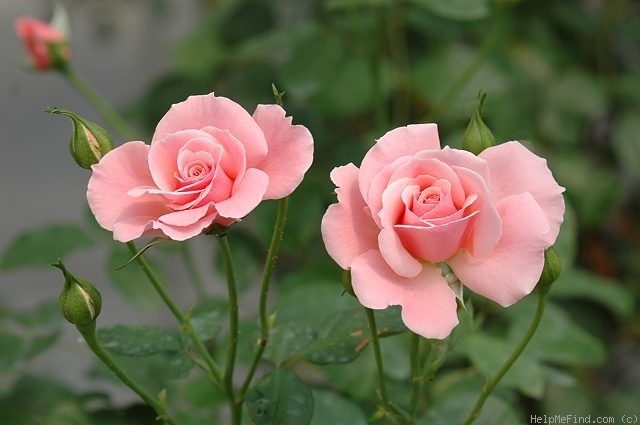
This screenshot has width=640, height=425. Identify the location of bulb. [x=77, y=300], [x=81, y=148].